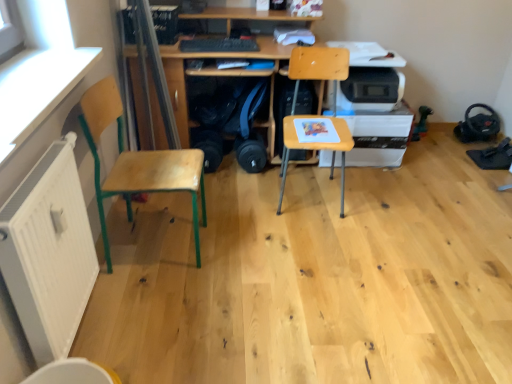
Where is `vacant space situated on the left part of wooden chair at center, arranged as the first chair when viewed from the right`? vacant space situated on the left part of wooden chair at center, arranged as the first chair when viewed from the right is located at coordinates (247, 199).